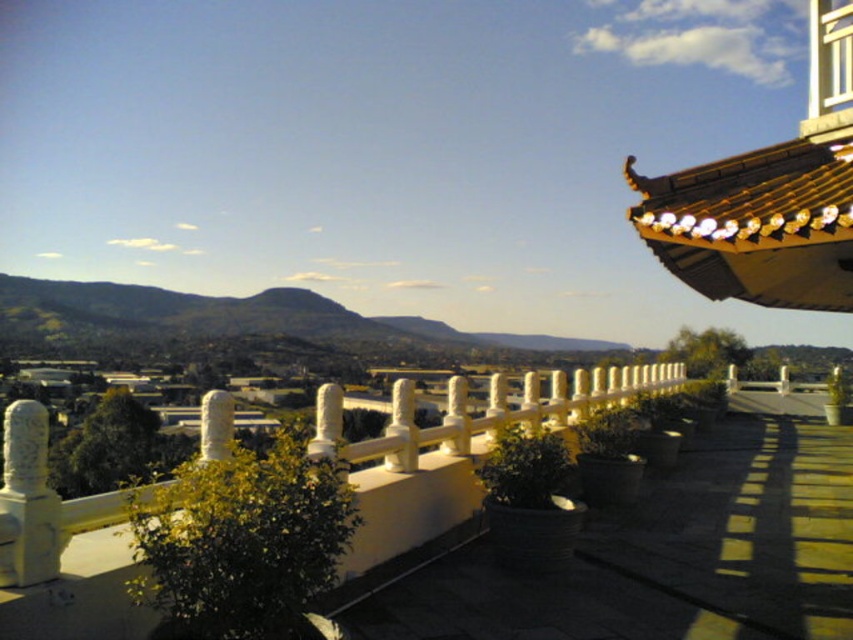
You are standing at the point marked as point (x=24, y=500) in the image. You want to walk straight ahead. How far will you have to walk before you can no longer see the golden roof with upturned eave? The golden roof with upturned eave is part of the traditional East Asian building in the scene.

The golden roof with upturned eave is visible as long as you are within 3.83 meters from the point (x=24, y=500). Once you walk beyond that distance, you will no longer be able to see it.

You are standing on the terrace and want to place a small decorative item exactly at the position of the white stone pillar at left. According to the coordinates provided, where should you place the item?

The white stone pillar at left is located at point [27,499], so you should place the item at those coordinates.

You are standing on the terrace and want to walk towards the white stone pillar at left and the white stone pillar at center. Which pillar should you approach first to reach the one closer to you?

You should approach the white stone pillar at left first because it is closer to you than the white stone pillar at center.